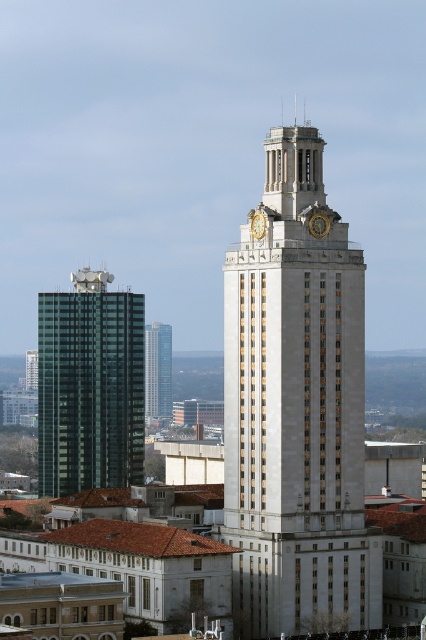
You are standing at the base of the white stone clock tower at center. You want to take a photo of the tower with your smartphone, which has a maximum zoom range of 10x. The recommended distance for optimal photo quality is 300 meters. Will you need to move closer or farther away to achieve the best quality?

The white stone clock tower at center is 349.83 meters away from camera, which is beyond the recommended 300 meters for optimal photo quality. To achieve the best quality, you should move closer to the tower.

You are an urban planner reviewing a city map and see a point marked at coordinates (319, 225). Based on the scene description, what significant architectural feature is this point located on?

The point at coordinates (319, 225) is located on the goldmaterialtexture clock at upper center of the tower.